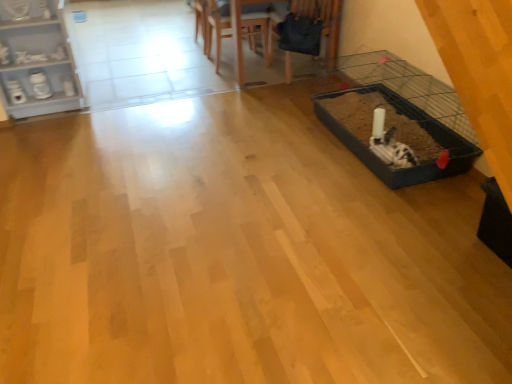
How much space does wooden chair at upper center, positioned as the 3th armchair in right-to-left order, occupy vertically?

wooden chair at upper center, positioned as the 3th armchair in right-to-left order, is 50.22 centimeters in height.

Measure the distance between point (x=196, y=9) and camera.

Point (x=196, y=9) is 14.65 feet away from camera.

I want to click on wooden chair at upper center, which is the 2th armchair in right-to-left order, so click(216, 28).

You are a GUI agent. You are given a task and a screenshot of the screen. Output one action in this format:
    pyautogui.click(x=<x>, y=<y>)
    Task: Click on the white painted wood shelf at upper left
    
    Given the screenshot: What is the action you would take?
    [36, 60]

What do you see at coordinates (237, 28) in the screenshot?
I see `wooden table at upper center` at bounding box center [237, 28].

Find the location of a particular element. The image size is (512, 384). wooden chair at upper center, positioned as the 3th armchair in right-to-left order is located at coordinates (205, 21).

Considering the positions of objects wooden table at upper center and velvet dark blue armchair at upper center, which ranks as the third armchair in left-to-right order, in the image provided, who is in front, wooden table at upper center or velvet dark blue armchair at upper center, which ranks as the third armchair in left-to-right order,?

wooden table at upper center.

Where is `table that appears on the left of velvet dark blue armchair at upper center, which ranks as the third armchair in left-to-right order`? The height and width of the screenshot is (384, 512). table that appears on the left of velvet dark blue armchair at upper center, which ranks as the third armchair in left-to-right order is located at coordinates (237, 28).

Considering the positions of point (238, 70) and point (334, 45), is point (238, 70) closer or farther from the camera than point (334, 45)?

Point (238, 70) is positioned farther from the camera compared to point (334, 45).

From the image's perspective, is wooden table at upper center on top of velvet dark blue armchair at upper center, acting as the first armchair starting from the right?

Yes, from the image's perspective, wooden table at upper center is over velvet dark blue armchair at upper center, acting as the first armchair starting from the right.

Is the depth of velvet dark blue armchair at upper center, acting as the first armchair starting from the right, less than that of white painted wood shelf at upper left?

No, the depth of velvet dark blue armchair at upper center, acting as the first armchair starting from the right, is greater than that of white painted wood shelf at upper left.

In order to click on armchair that is the 1st one when counting backward from the white painted wood shelf at upper left in this screenshot , I will do `click(323, 23)`.

From the image's perspective, which one is positioned higher, velvet dark blue armchair at upper center, which ranks as the third armchair in left-to-right order, or white painted wood shelf at upper left?

velvet dark blue armchair at upper center, which ranks as the third armchair in left-to-right order, from the image's perspective.

From the image's perspective, is wooden chair at upper center, positioned as the first armchair in left-to-right order, located above or below wooden table at upper center?

From the image's perspective, wooden chair at upper center, positioned as the first armchair in left-to-right order, appears above wooden table at upper center.

Can you confirm if wooden chair at upper center, positioned as the first armchair in left-to-right order, is positioned to the left of wooden table at upper center?

Correct, you'll find wooden chair at upper center, positioned as the first armchair in left-to-right order, to the left of wooden table at upper center.

Would you say wooden chair at upper center, positioned as the 3th armchair in right-to-left order, is outside wooden table at upper center?

Actually, wooden chair at upper center, positioned as the 3th armchair in right-to-left order, is within wooden table at upper center.

Is wooden chair at upper center, which ranks as the 2th armchair in left-to-right order, bigger or smaller than wooden chair at upper center, positioned as the first armchair in left-to-right order?

Clearly, wooden chair at upper center, which ranks as the 2th armchair in left-to-right order, is larger in size than wooden chair at upper center, positioned as the first armchair in left-to-right order.

Can you confirm if wooden chair at upper center, which ranks as the 2th armchair in left-to-right order, is shorter than wooden chair at upper center, positioned as the 3th armchair in right-to-left order?

No, wooden chair at upper center, which ranks as the 2th armchair in left-to-right order, is not shorter than wooden chair at upper center, positioned as the 3th armchair in right-to-left order.

Which object is closer to the camera, wooden chair at upper center, which ranks as the 2th armchair in left-to-right order, or wooden chair at upper center, positioned as the 3th armchair in right-to-left order?

wooden chair at upper center, which ranks as the 2th armchair in left-to-right order, is more forward.

Is wooden chair at upper center, which ranks as the 2th armchair in left-to-right order, turned away from wooden chair at upper center, positioned as the first armchair in left-to-right order?

wooden chair at upper center, which ranks as the 2th armchair in left-to-right order, is not turned away from wooden chair at upper center, positioned as the first armchair in left-to-right order.

In the scene shown: Which object is positioned more to the left, velvet dark blue armchair at upper center, which ranks as the third armchair in left-to-right order, or wooden table at upper center?

wooden table at upper center is more to the left.

Is velvet dark blue armchair at upper center, which ranks as the third armchair in left-to-right order, looking in the opposite direction of wooden table at upper center?

Yes, velvet dark blue armchair at upper center, which ranks as the third armchair in left-to-right order,'s orientation is away from wooden table at upper center.

From a real-world perspective, is velvet dark blue armchair at upper center, acting as the first armchair starting from the right, physically located above or below wooden table at upper center?

From a real-world perspective, velvet dark blue armchair at upper center, acting as the first armchair starting from the right, is physically below wooden table at upper center.

Find the location of a particular element. This screenshot has height=384, width=512. table above the velvet dark blue armchair at upper center, which ranks as the third armchair in left-to-right order (from the image's perspective) is located at coordinates (237, 28).

Which is correct: white painted wood shelf at upper left is inside wooden table at upper center, or outside of it?

white painted wood shelf at upper left is not enclosed by wooden table at upper center.

From a real-world perspective, does white painted wood shelf at upper left stand above wooden table at upper center?

Yes, from a real-world perspective, white painted wood shelf at upper left is on top of wooden table at upper center.

How distant is white painted wood shelf at upper left from wooden table at upper center?

white painted wood shelf at upper left and wooden table at upper center are 1.44 meters apart from each other.

Does white painted wood shelf at upper left have a lesser height compared to wooden table at upper center?

No, white painted wood shelf at upper left is not shorter than wooden table at upper center.

Does point (215, 21) appear closer or farther from the camera than point (192, 3)?

Clearly, point (215, 21) is closer to the camera than point (192, 3).

From the image's perspective, which is above, wooden table at upper center or wooden chair at upper center, positioned as the 3th armchair in right-to-left order?

From the image's view, wooden chair at upper center, positioned as the 3th armchair in right-to-left order, is above.

How distant is wooden table at upper center from wooden chair at upper center, positioned as the 3th armchair in right-to-left order?

The distance of wooden table at upper center from wooden chair at upper center, positioned as the 3th armchair in right-to-left order, is 8.12 inches.

From their relative heights in the image, would you say wooden table at upper center is taller or shorter than wooden chair at upper center, positioned as the 3th armchair in right-to-left order?

Considering their sizes, wooden table at upper center has more height than wooden chair at upper center, positioned as the 3th armchair in right-to-left order.

The width and height of the screenshot is (512, 384). In order to click on table in front of the velvet dark blue armchair at upper center, which ranks as the third armchair in left-to-right order in this screenshot , I will do `click(237, 28)`.

Identify the location of shelf that is on the left side of velvet dark blue armchair at upper center, which ranks as the third armchair in left-to-right order. The width and height of the screenshot is (512, 384). (36, 60).

Based on their spatial positions, is white painted wood shelf at upper left or velvet dark blue armchair at upper center, acting as the first armchair starting from the right, closer to wooden table at upper center?

velvet dark blue armchair at upper center, acting as the first armchair starting from the right, is positioned closer to the anchor wooden table at upper center.

Which object lies further to the anchor point wooden chair at upper center, positioned as the 3th armchair in right-to-left order, wooden chair at upper center, which is the 2th armchair in right-to-left order, or velvet dark blue armchair at upper center, acting as the first armchair starting from the right?

The object further to wooden chair at upper center, positioned as the 3th armchair in right-to-left order, is velvet dark blue armchair at upper center, acting as the first armchair starting from the right.

Considering their positions, is wooden chair at upper center, which is the 2th armchair in right-to-left order, positioned further to wooden chair at upper center, positioned as the 3th armchair in right-to-left order, than white painted wood shelf at upper left?

white painted wood shelf at upper left is further to wooden chair at upper center, positioned as the 3th armchair in right-to-left order.

Estimate the real-world distances between objects in this image. Which object is closer to white painted wood shelf at upper left, velvet dark blue armchair at upper center, acting as the first armchair starting from the right, or wooden chair at upper center, positioned as the first armchair in left-to-right order?

wooden chair at upper center, positioned as the first armchair in left-to-right order, is closer to white painted wood shelf at upper left.

Looking at the image, which one is located closer to velvet dark blue armchair at upper center, acting as the first armchair starting from the right, wooden chair at upper center, which ranks as the 2th armchair in left-to-right order, or wooden chair at upper center, positioned as the first armchair in left-to-right order?

Among the two, wooden chair at upper center, which ranks as the 2th armchair in left-to-right order, is located nearer to velvet dark blue armchair at upper center, acting as the first armchair starting from the right.

Based on their spatial positions, is wooden table at upper center or wooden chair at upper center, which is the 2th armchair in right-to-left order, closer to white painted wood shelf at upper left?

Based on the image, wooden chair at upper center, which is the 2th armchair in right-to-left order, appears to be nearer to white painted wood shelf at upper left.

Based on their spatial positions, is white painted wood shelf at upper left or wooden table at upper center closer to wooden chair at upper center, which is the 2th armchair in right-to-left order?

wooden table at upper center lies closer to wooden chair at upper center, which is the 2th armchair in right-to-left order, than the other object.

Considering their positions, is white painted wood shelf at upper left positioned further to wooden chair at upper center, positioned as the first armchair in left-to-right order, than wooden chair at upper center, which ranks as the 2th armchair in left-to-right order?

white painted wood shelf at upper left is further to wooden chair at upper center, positioned as the first armchair in left-to-right order.

Locate an element on the screen. table between white painted wood shelf at upper left and velvet dark blue armchair at upper center, which ranks as the third armchair in left-to-right order, from left to right is located at coordinates (237, 28).

In order to click on table between wooden chair at upper center, which ranks as the 2th armchair in left-to-right order, and velvet dark blue armchair at upper center, acting as the first armchair starting from the right in this screenshot , I will do `click(237, 28)`.

Find the location of a particular element. This screenshot has height=384, width=512. armchair situated between white painted wood shelf at upper left and wooden chair at upper center, which ranks as the 2th armchair in left-to-right order, from left to right is located at coordinates (205, 21).

What are the coordinates of `armchair situated between wooden chair at upper center, positioned as the 3th armchair in right-to-left order, and velvet dark blue armchair at upper center, acting as the first armchair starting from the right, from left to right` in the screenshot? It's located at (216, 28).